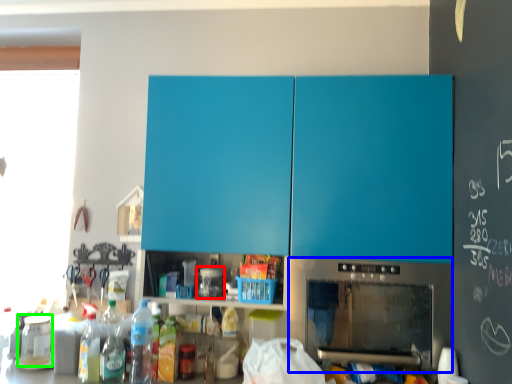
Question: Based on their relative distances, which object is nearer to appliance (highlighted by a red box)? Choose from home appliance (highlighted by a blue box) and appliance (highlighted by a green box).

Choices:
 (A) home appliance
 (B) appliance

Answer: (A)